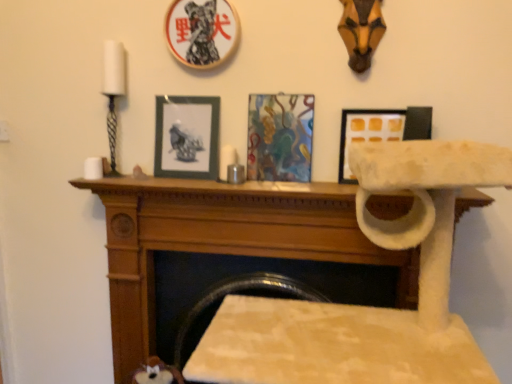
At what (x,y) coordinates should I click in order to perform the action: click on free space above wooden mantle at center (from a real-world perspective). Please return your answer as a coordinate pair (x, y). The width and height of the screenshot is (512, 384). Looking at the image, I should click on (240, 177).